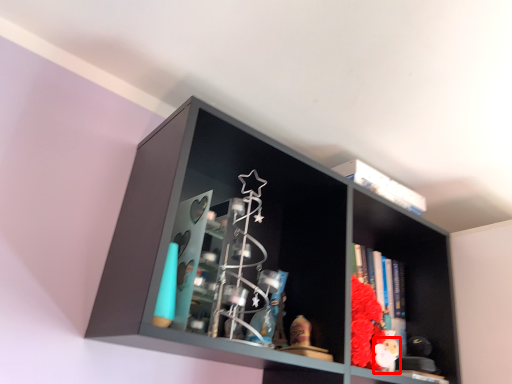
Question: From the image's perspective, where is toy (annotated by the red box) located relative to shelf?

Choices:
 (A) below
 (B) above

Answer: (A)